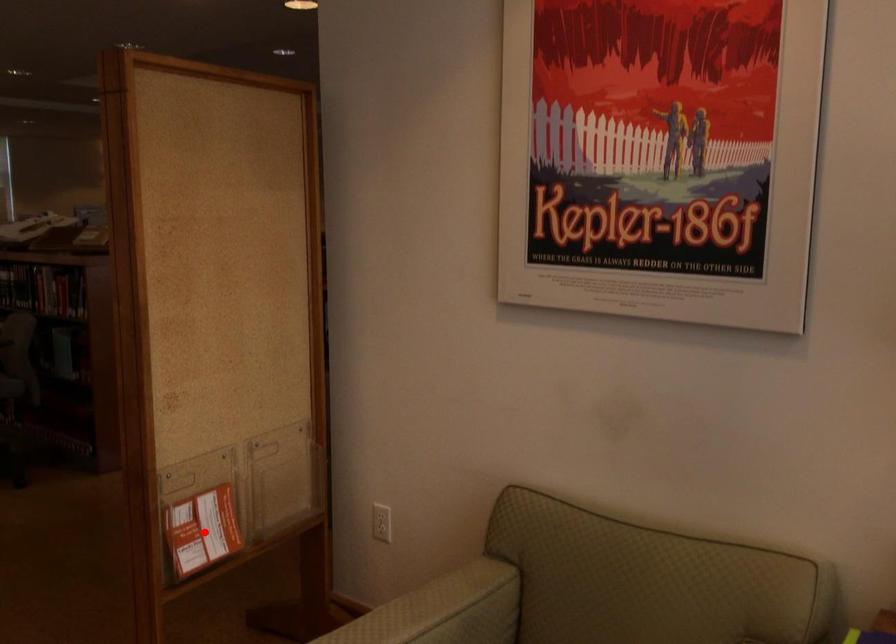
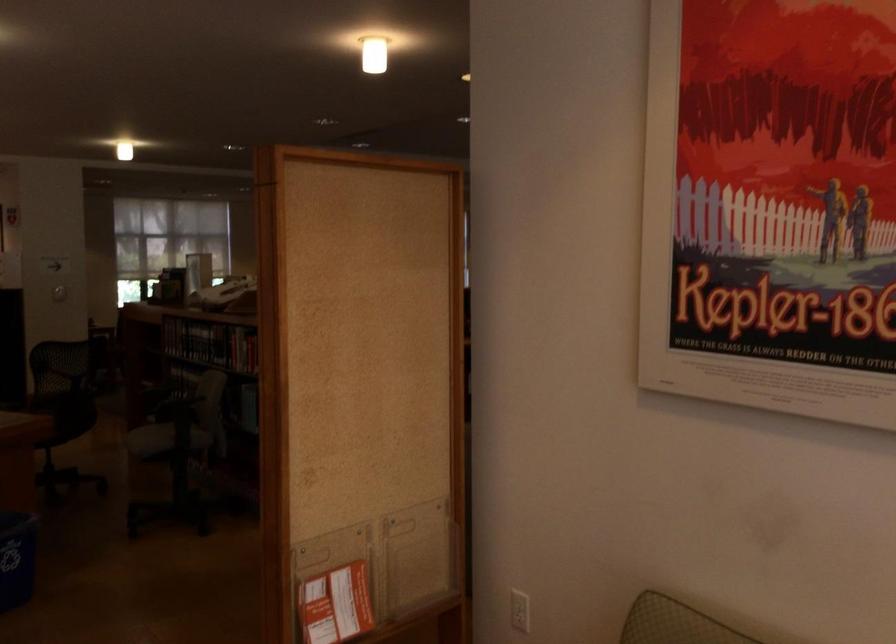
The point at the highlighted location is marked in the first image. Where is the corresponding point in the second image?

(336, 605)